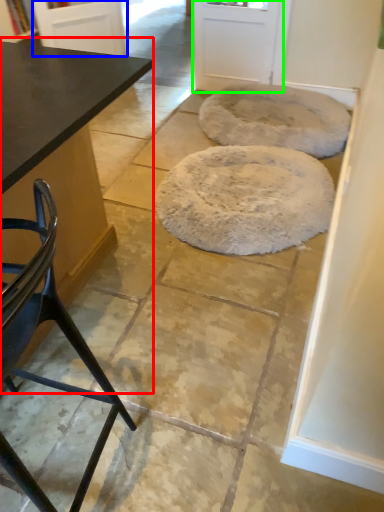
Question: Considering the real-world distances, which object is farthest from table (highlighted by a red box)? screen door (highlighted by a blue box) or screen door (highlighted by a green box)?

Choices:
 (A) screen door
 (B) screen door

Answer: (B)